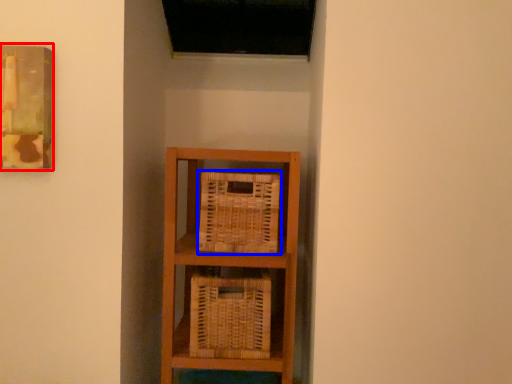
Question: Which object appears farthest to the camera in this image, picture frame (highlighted by a red box) or basket (highlighted by a blue box)?

Choices:
 (A) picture frame
 (B) basket

Answer: (B)